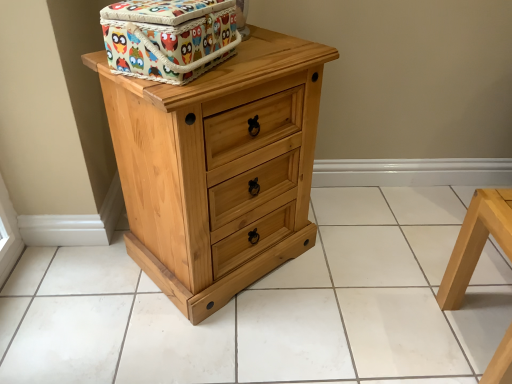
Question: Considering the relative positions of natural wood tile at center and multicolored fabric box at upper center in the image provided, is natural wood tile at center to the left or to the right of multicolored fabric box at upper center?

Choices:
 (A) right
 (B) left

Answer: (A)

Question: Considering the positions of point (503, 322) and point (116, 44), is point (503, 322) closer or farther from the camera than point (116, 44)?

Choices:
 (A) closer
 (B) farther

Answer: (B)

Question: Estimate the real-world distances between objects in this image. Which object is farther from the light wood stool at lower right?

Choices:
 (A) natural wood tile at center
 (B) natural wood chest of drawers at center
 (C) multicolored fabric box at upper center

Answer: (C)

Question: Which object is positioned farthest from the natural wood chest of drawers at center?

Choices:
 (A) multicolored fabric box at upper center
 (B) light wood stool at lower right
 (C) natural wood tile at center

Answer: (B)